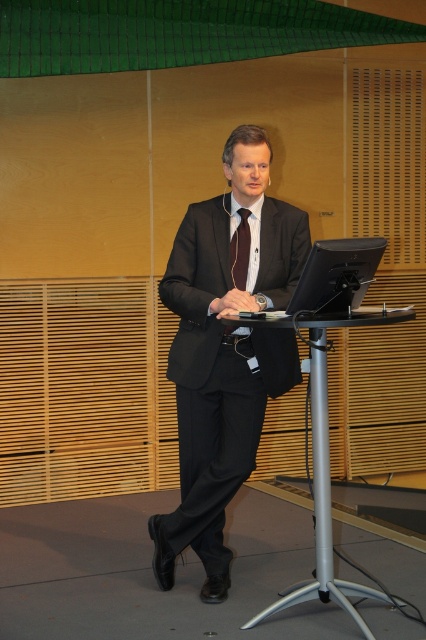
You are an attendee at a conference and want to take a photo of the presenter. The photographer needs to position themselves so that both the silver metallic table at center and the dark brown silk tie at center are visible in the frame. Based on their positions, which side of the presenter should you stand to capture both objects in the photo?

To capture both the silver metallic table at center and the dark brown silk tie at center in the photo, you should stand to the left side of the presenter. This is because the silver metallic table at center is positioned to the right of the dark brown silk tie at center, so standing on the left allows both objects to be visible in the frame.

You are an event planner organizing a presentation. You need to ensure that the presenter can easily access their laptop and papers on the silver metallic table at center while also being visible to the audience. Considering the dark brown silk tie at center is part of the presenter, where should you position the presenter relative to the table?

The silver metallic table at center is in front of the dark brown silk tie at center, meaning the presenter should be positioned behind the table to ensure the audience can see them clearly while they access the laptop and papers on the table.

From the picture: You are an assistant helping to set up a presentation. You need to place a name tag on the desk so it is visible to the audience but not blocking the monitor. The name tag should be placed to the right of the matte black suit at center. Where should you place the name tag relative to the black glossy monitor at center?

The matte black suit at center is to the left of the black glossy monitor at center. Therefore, placing the name tag to the right of the matte black suit at center would position it either to the right of the monitor or between the suit and the monitor. However, since the name tag needs to be visible to the audience and not block the monitor, the best placement is to the right side of the black glossy monitor at center.